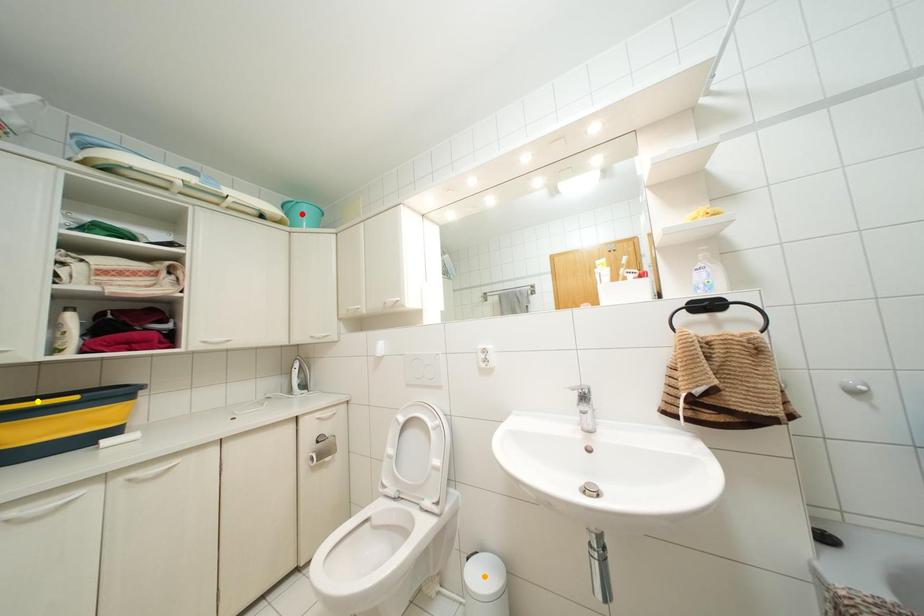
Order these from nearest to farthest:
1. orange point
2. red point
3. yellow point

red point < orange point < yellow point